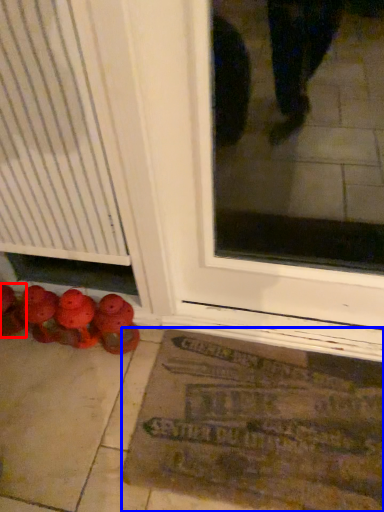
Question: Among these objects, which one is nearest to the camera, footwear (highlighted by a red box) or bath mat (highlighted by a blue box)?

Choices:
 (A) footwear
 (B) bath mat

Answer: (B)